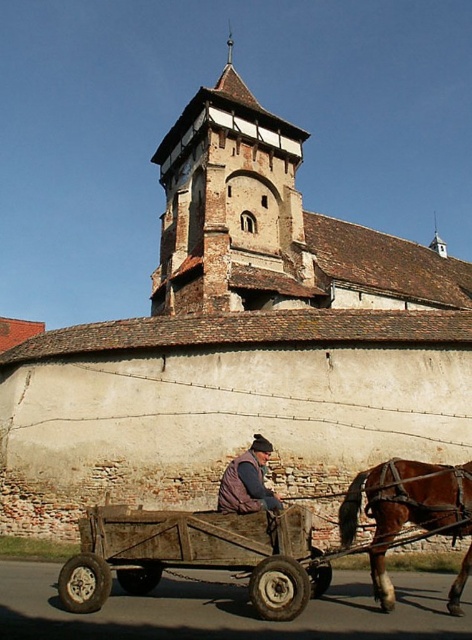
Question: Which of the following is the farthest from the observer?

Choices:
 (A) (x=258, y=554)
 (B) (x=222, y=509)
 (C) (x=278, y=202)
 (D) (x=427, y=525)

Answer: (C)

Question: Which object is the closest to the brown stone tower at upper center?

Choices:
 (A) dark brown leather jacket at center
 (B) brown glossy horse at lower right
 (C) wooden wagon at center

Answer: (C)

Question: Does wooden wagon at center appear on the left side of dark brown leather jacket at center?

Choices:
 (A) yes
 (B) no

Answer: (A)

Question: Considering the real-world distances, which object is farthest from the brown glossy horse at lower right?

Choices:
 (A) brown stone tower at upper center
 (B) dark brown leather jacket at center
 (C) wooden wagon at center

Answer: (A)

Question: Does brown stone tower at upper center appear on the left side of wooden wagon at center?

Choices:
 (A) yes
 (B) no

Answer: (A)

Question: Is wooden wagon at center to the left of brown glossy horse at lower right from the viewer's perspective?

Choices:
 (A) yes
 (B) no

Answer: (A)